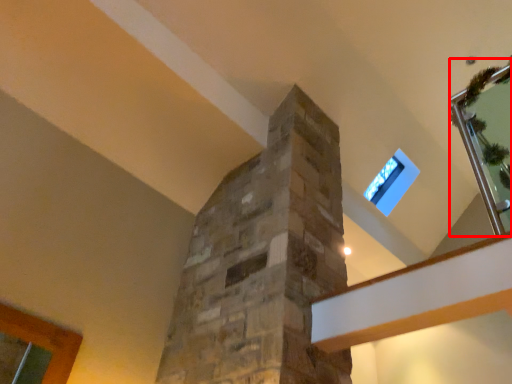
Question: From the image, what is the correct spatial relationship of glass door (annotated by the red box) in relation to window?

Choices:
 (A) left
 (B) right

Answer: (B)